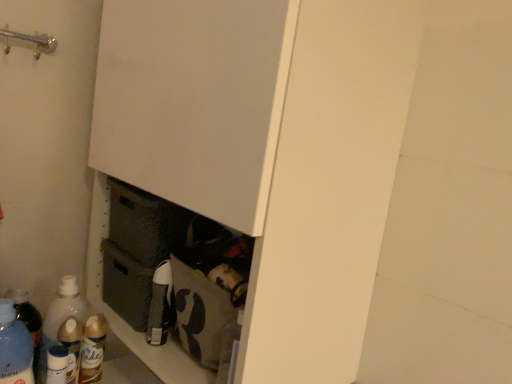
Question: Is brushed metal door handle at upper left closer to the viewer compared to white matte cupboard at center?

Choices:
 (A) yes
 (B) no

Answer: (B)

Question: From a real-world perspective, is brushed metal door handle at upper left on white matte cupboard at center?

Choices:
 (A) no
 (B) yes

Answer: (B)

Question: Is brushed metal door handle at upper left facing towards white matte cupboard at center?

Choices:
 (A) yes
 (B) no

Answer: (B)

Question: From the image's perspective, is brushed metal door handle at upper left below white matte cupboard at center?

Choices:
 (A) no
 (B) yes

Answer: (A)

Question: From a real-world perspective, is brushed metal door handle at upper left located beneath white matte cupboard at center?

Choices:
 (A) no
 (B) yes

Answer: (A)

Question: Would you say brushed metal door handle at upper left is to the left or to the right of white matte cupboard at center in the picture?

Choices:
 (A) left
 (B) right

Answer: (A)

Question: From the image's perspective, is brushed metal door handle at upper left located above or below white matte cupboard at center?

Choices:
 (A) below
 (B) above

Answer: (B)

Question: Is brushed metal door handle at upper left in front of or behind white matte cupboard at center in the image?

Choices:
 (A) behind
 (B) front

Answer: (A)

Question: In terms of height, does brushed metal door handle at upper left look taller or shorter compared to white matte cupboard at center?

Choices:
 (A) tall
 (B) short

Answer: (B)

Question: From the image's perspective, is translucent plastic spray can at lower left, the 4th bottle when ordered from left to right, located above or below white matte cupboard at center?

Choices:
 (A) above
 (B) below

Answer: (B)

Question: Considering the relative positions of translucent plastic spray can at lower left, positioned as the 2th bottle in right-to-left order, and white matte cupboard at center in the image provided, is translucent plastic spray can at lower left, positioned as the 2th bottle in right-to-left order, to the left or to the right of white matte cupboard at center?

Choices:
 (A) right
 (B) left

Answer: (B)

Question: In terms of height, does translucent plastic spray can at lower left, the 4th bottle when ordered from left to right, look taller or shorter compared to white matte cupboard at center?

Choices:
 (A) short
 (B) tall

Answer: (A)

Question: From a real-world perspective, is translucent plastic spray can at lower left, the 4th bottle when ordered from left to right, positioned above or below white matte cupboard at center?

Choices:
 (A) above
 (B) below

Answer: (B)

Question: Based on their positions, is translucent plastic bottle at lower left, which ranks as the 5th bottle in right-to-left order, located to the left or right of white matte cupboard at center?

Choices:
 (A) right
 (B) left

Answer: (B)

Question: Based on their sizes in the image, would you say translucent plastic bottle at lower left, which ranks as the 5th bottle in right-to-left order, is bigger or smaller than white matte cupboard at center?

Choices:
 (A) big
 (B) small

Answer: (B)